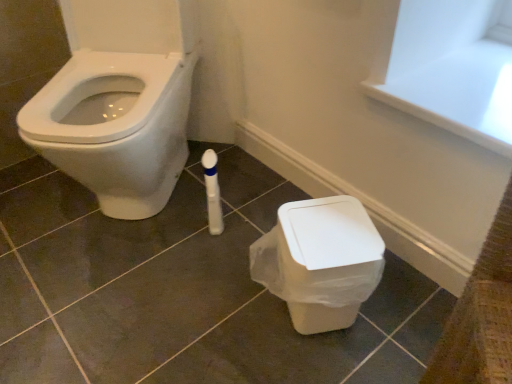
This screenshot has width=512, height=384. What are the coordinates of `free space in front of white glossy bidet at left` in the screenshot? It's located at click(124, 298).